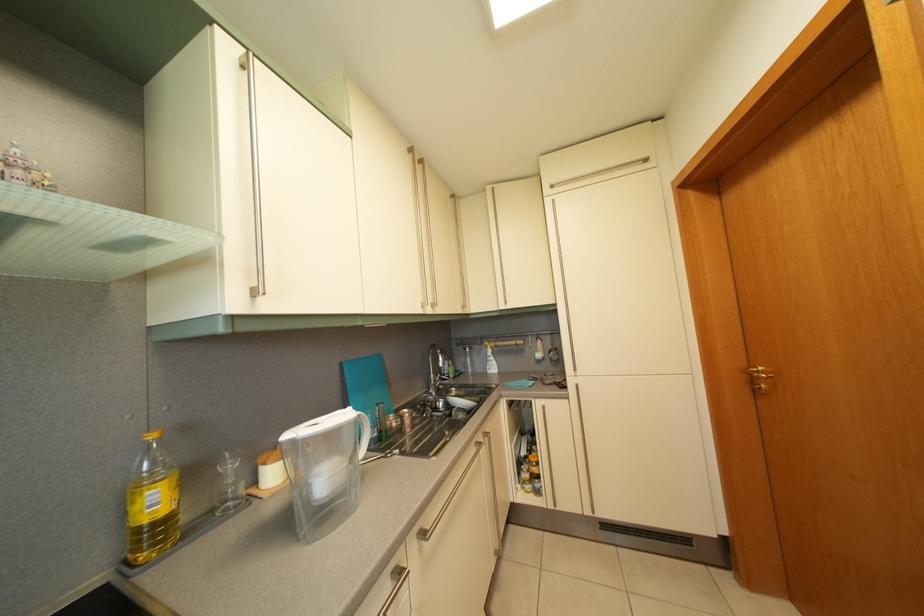
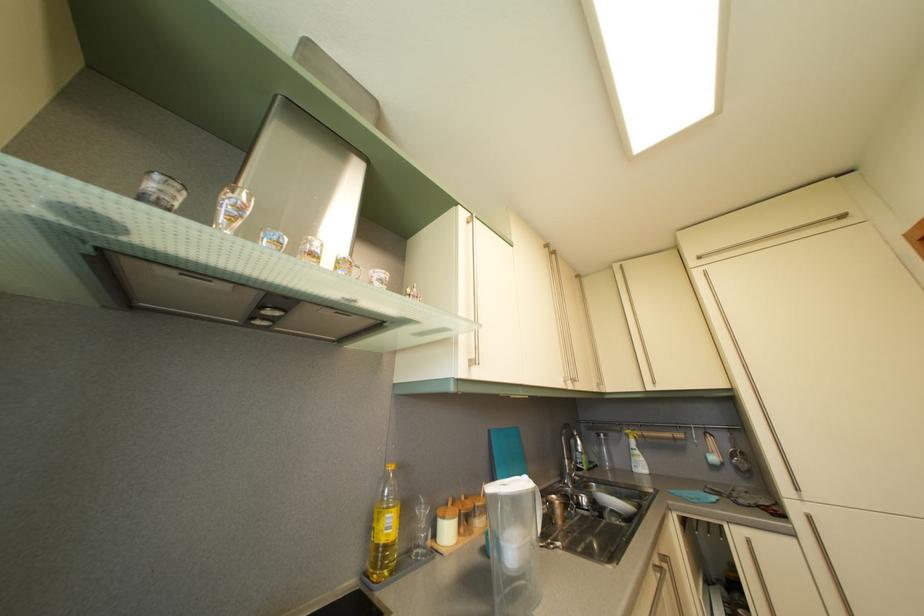
Where in the second image is the point corresponding to point (462, 415) from the first image?

(613, 516)